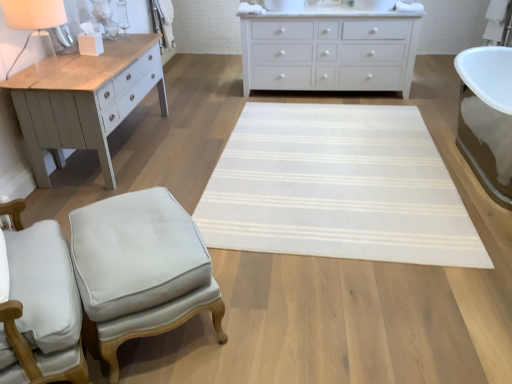
Identify the location of light gray fabric stool at lower left. This screenshot has width=512, height=384. (141, 268).

From a real-world perspective, is white matte chest of drawers at upper center located higher than white fabric chair at lower left?

Actually, white matte chest of drawers at upper center is physically below white fabric chair at lower left in the real world.

What's the angular difference between white matte chest of drawers at upper center and white fabric chair at lower left's facing directions?

white matte chest of drawers at upper center and white fabric chair at lower left are facing 122 degrees away from each other.

Does white matte chest of drawers at upper center touch white fabric chair at lower left?

white matte chest of drawers at upper center is not next to white fabric chair at lower left, and they're not touching.

Is white matte chest of drawers at upper center not inside white fabric chair at lower left?

That's correct, white matte chest of drawers at upper center is outside of white fabric chair at lower left.

Which object is wider, white matte chest of drawers at upper center or white woven mat at center?

Wider between the two is white woven mat at center.

From a real-world perspective, is white matte chest of drawers at upper center above or below white woven mat at center?

Clearly, from a real-world perspective, white matte chest of drawers at upper center is above white woven mat at center.

Can you confirm if white matte chest of drawers at upper center is bigger than white woven mat at center?

Yes.

You are a GUI agent. You are given a task and a screenshot of the screen. Output one action in this format:
    pyautogui.click(x=<x>, y=<y>)
    Task: Click on the chest of drawers above the white woven mat at center (from the image's perspective)
    This screenshot has height=384, width=512.
    Given the screenshot: What is the action you would take?
    pyautogui.click(x=328, y=49)

Does white matte table lamp at upper left touch white woven mat at center?

They are not placed beside each other.

In terms of height, does white matte table lamp at upper left look taller or shorter compared to white woven mat at center?

In the image, white matte table lamp at upper left appears to be taller than white woven mat at center.

Choose the correct answer: Is white matte table lamp at upper left inside white woven mat at center or outside it?

white matte table lamp at upper left cannot be found inside white woven mat at center.

From the image's perspective, who appears lower, white fabric chair at lower left or white matte table lamp at upper left?

white fabric chair at lower left.

Is white fabric chair at lower left facing away from white matte table lamp at upper left?

No, white matte table lamp at upper left is not at the back of white fabric chair at lower left.

Between white fabric chair at lower left and white matte table lamp at upper left, which one appears on the right side from the viewer's perspective?

From the viewer's perspective, white fabric chair at lower left appears more on the right side.

Is point (32, 328) behind point (17, 15)?

That is False.

Would you say light gray fabric stool at lower left is outside white fabric chair at lower left?

Indeed, light gray fabric stool at lower left is completely outside white fabric chair at lower left.

From their relative heights in the image, would you say light gray fabric stool at lower left is taller or shorter than white fabric chair at lower left?

In the image, light gray fabric stool at lower left appears to be shorter than white fabric chair at lower left.

From a real-world perspective, is light gray fabric stool at lower left over white fabric chair at lower left?

No.

Is light gray fabric stool at lower left far from white fabric chair at lower left?

Actually, light gray fabric stool at lower left and white fabric chair at lower left are a little close together.

Is the depth of white matte table lamp at upper left greater than that of white matte chest of drawers at upper center?

No, white matte table lamp at upper left is closer to the camera.

From a real-world perspective, who is located higher, white matte table lamp at upper left or white matte chest of drawers at upper center?

white matte table lamp at upper left.

Looking at this image, is white matte table lamp at upper left turned away from white matte chest of drawers at upper center?

No, white matte table lamp at upper left is not facing away from white matte chest of drawers at upper center.

Is white matte table lamp at upper left next to white matte chest of drawers at upper center?

No, white matte table lamp at upper left is not in contact with white matte chest of drawers at upper center.

Is white matte chest of drawers at upper center inside the boundaries of white matte table lamp at upper left, or outside?

white matte chest of drawers at upper center is spatially situated outside white matte table lamp at upper left.

Which is nearer, (351, 87) or (13, 12)?

Point (351, 87) appears to be farther away from the viewer than point (13, 12).

Is white matte chest of drawers at upper center behind white matte table lamp at upper left?

Yes, it is behind white matte table lamp at upper left.

Based on their sizes in the image, would you say white matte chest of drawers at upper center is bigger or smaller than white matte table lamp at upper left?

Clearly, white matte chest of drawers at upper center is larger in size than white matte table lamp at upper left.

This screenshot has width=512, height=384. In the image, there is a white fabric chair at lower left. What are the coordinates of `the chest of drawers below it (from a real-world perspective)` in the screenshot? It's located at (328, 49).

Locate an element on the screen. mat lying below the white matte chest of drawers at upper center (from the image's perspective) is located at coordinates (337, 187).

From the image, which object appears to be farther from light gray fabric stool at lower left, white matte table lamp at upper left or white fabric chair at lower left?

Among the two, white matte table lamp at upper left is located further to light gray fabric stool at lower left.

Consider the image. Considering their positions, is white fabric chair at lower left positioned further to white matte chest of drawers at upper center than white matte table lamp at upper left?

white fabric chair at lower left.

Estimate the real-world distances between objects in this image. Which object is further from white matte table lamp at upper left, light gray fabric stool at lower left or white woven mat at center?

The object further to white matte table lamp at upper left is white woven mat at center.

Considering their positions, is white matte chest of drawers at upper center positioned further to light gray fabric stool at lower left than white woven mat at center?

white matte chest of drawers at upper center.

Considering their positions, is light gray fabric stool at lower left positioned further to white woven mat at center than white matte chest of drawers at upper center?

white matte chest of drawers at upper center.

When comparing their distances from white fabric chair at lower left, does white matte table lamp at upper left or white woven mat at center seem closer?

white matte table lamp at upper left lies closer to white fabric chair at lower left than the other object.

Considering their positions, is white woven mat at center positioned further to white matte chest of drawers at upper center than white matte table lamp at upper left?

white matte table lamp at upper left lies further to white matte chest of drawers at upper center than the other object.

When comparing their distances from white matte table lamp at upper left, does white fabric chair at lower left or white woven mat at center seem closer?

white fabric chair at lower left lies closer to white matte table lamp at upper left than the other object.

Identify the location of mat between light gray fabric stool at lower left and white matte chest of drawers at upper center from front to back. (337, 187).

What are the coordinates of `stool between white matte table lamp at upper left and white woven mat at center from left to right` in the screenshot? It's located at (141, 268).

The width and height of the screenshot is (512, 384). I want to click on chair that lies between white matte table lamp at upper left and light gray fabric stool at lower left from top to bottom, so click(x=38, y=305).

The width and height of the screenshot is (512, 384). Find the location of `mat between white fabric chair at lower left and white matte chest of drawers at upper center from front to back`. mat between white fabric chair at lower left and white matte chest of drawers at upper center from front to back is located at coordinates (337, 187).